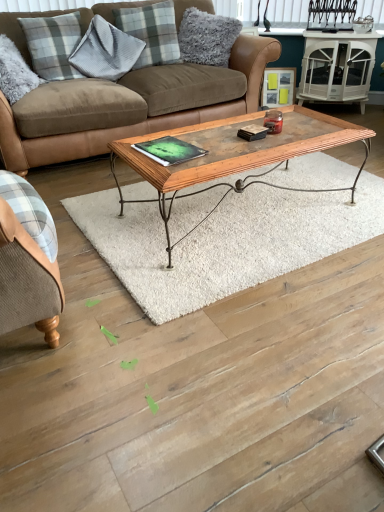
At what (x,y) coordinates should I click in order to perform the action: click on free space in front of wooden glass top coffee table at center. Please return your answer as a coordinate pair (x, y). Looking at the image, I should click on (244, 266).